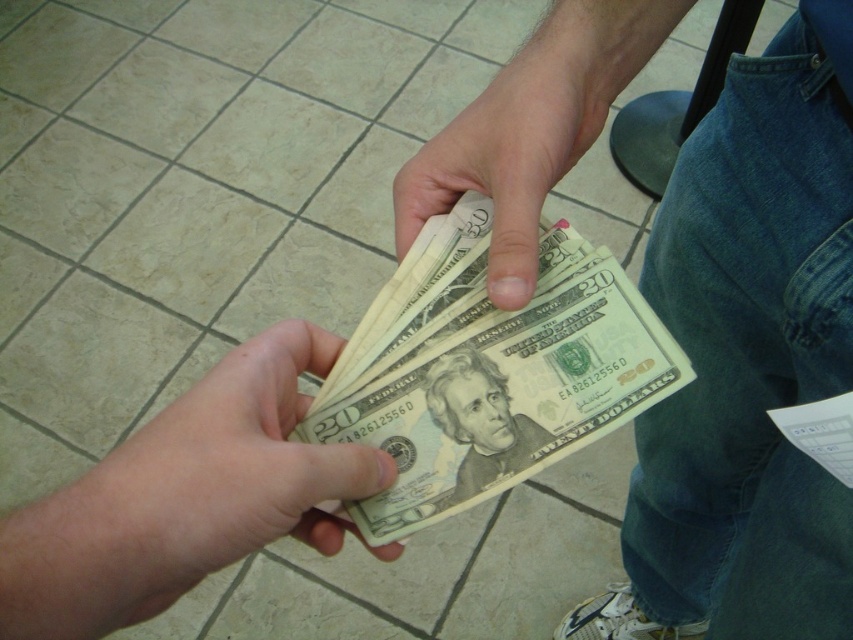
Which of these two, matte paper money at center or smooth paper twenty-dollar bill at center, stands shorter?

smooth paper twenty-dollar bill at center is shorter.

Between matte paper money at center and smooth paper twenty-dollar bill at center, which one has more height?

matte paper money at center

Between point (548, 163) and point (529, 426), which one is positioned behind?

The point (529, 426) is more distant.

Identify the location of matte paper money at center. (509, 156).

Is point (614, 378) farther from camera compared to point (476, 432)?

Yes, it is.

Is light brown paper money at center thinner than smooth paper twenty-dollar bill at center?

Incorrect, light brown paper money at center's width is not less than smooth paper twenty-dollar bill at center's.

Does point (590, 381) come in front of point (428, 397)?

That is False.

Locate an element on the screen. light brown paper money at center is located at coordinates (502, 388).

Who is lower down, smooth paper money at center or smooth yellowish-green bill at center?

smooth paper money at center

Is point (502, 106) positioned before point (155, 480)?

No, it is behind (155, 480).

The height and width of the screenshot is (640, 853). In order to click on smooth paper money at center in this screenshot , I will do `click(747, 360)`.